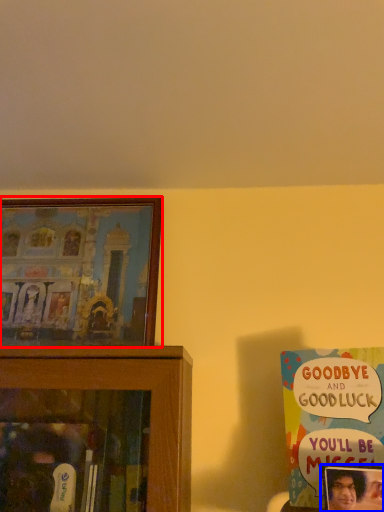
Question: Which of the following is the farthest to the observer, picture frame (highlighted by a red box) or picture frame (highlighted by a blue box)?

Choices:
 (A) picture frame
 (B) picture frame

Answer: (A)